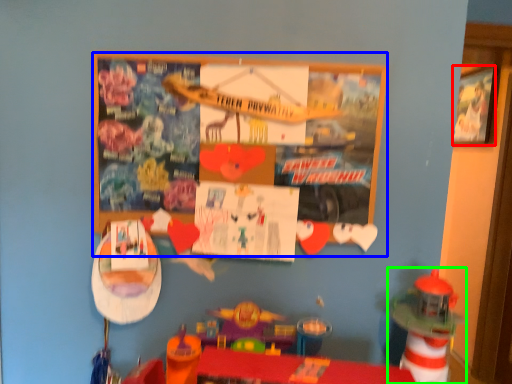
Question: Considering the real-world distances, which object is farthest from picture frame (highlighted by a red box)? bulletin board (highlighted by a blue box) or toy (highlighted by a green box)?

Choices:
 (A) bulletin board
 (B) toy

Answer: (A)